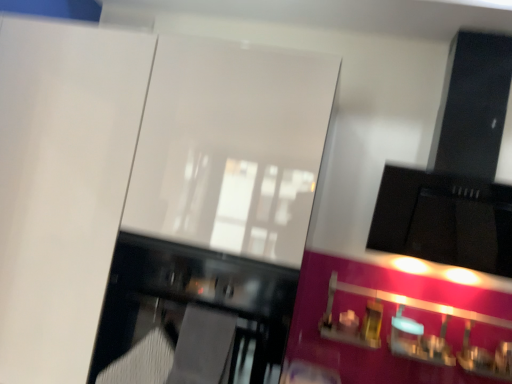
At what (x,y) coordinates should I click in order to perform the action: click on vacant region above pink glossy cabinet at lower right (from a real-world perspective). Please return your answer as a coordinate pair (x, y). The height and width of the screenshot is (384, 512). Looking at the image, I should click on (424, 285).